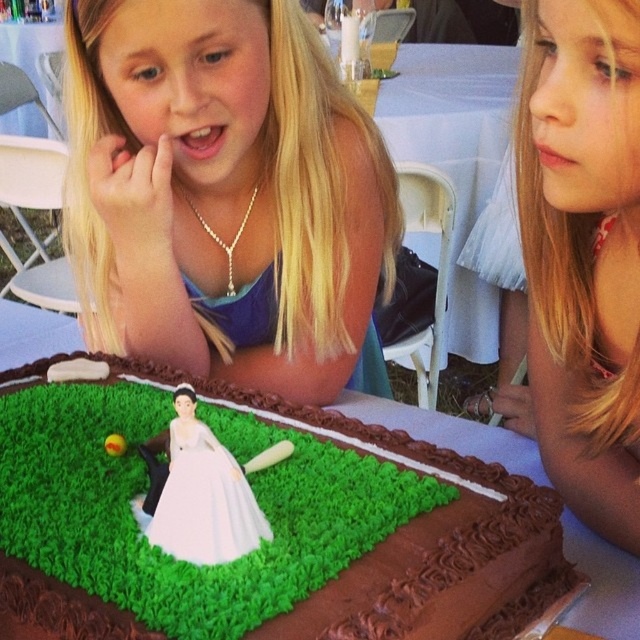
Which of these two, matte gold necklace at center or blonde hair at upper right, stands shorter?

Standing shorter between the two is blonde hair at upper right.

Can you confirm if matte gold necklace at center is smaller than blonde hair at upper right?

No.

Where is `matte gold necklace at center`? The height and width of the screenshot is (640, 640). matte gold necklace at center is located at coordinates (225, 193).

I want to click on matte gold necklace at center, so click(x=225, y=193).

The width and height of the screenshot is (640, 640). What do you see at coordinates (269, 524) in the screenshot?
I see `chocolate fondant baseball field at center` at bounding box center [269, 524].

Is chocolate fondant baseball field at center bigger than blonde hair at upper right?

Indeed, chocolate fondant baseball field at center has a larger size compared to blonde hair at upper right.

At what (x,y) coordinates should I click in order to perform the action: click on chocolate fondant baseball field at center. Please return your answer as a coordinate pair (x, y). This screenshot has height=640, width=640. Looking at the image, I should click on (269, 524).

Is matte gold necklace at center to the left of chocolate fondant baseball field at center from the viewer's perspective?

In fact, matte gold necklace at center is to the right of chocolate fondant baseball field at center.

Does matte gold necklace at center have a larger size compared to chocolate fondant baseball field at center?

Yes, matte gold necklace at center is bigger than chocolate fondant baseball field at center.

This screenshot has width=640, height=640. I want to click on matte gold necklace at center, so click(225, 193).

Locate an element on the screen. matte gold necklace at center is located at coordinates (225, 193).